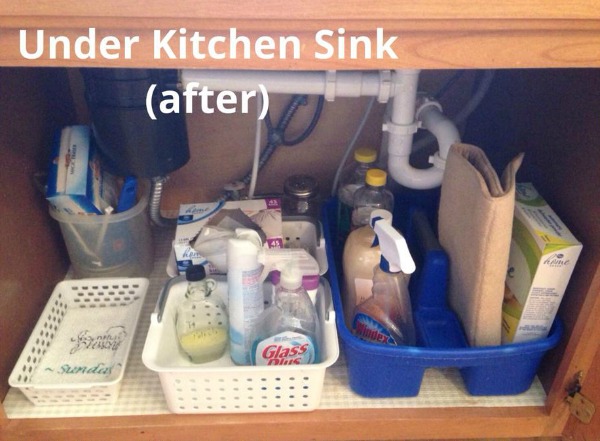
Identify the location of photo taken under a kitchen sink. (323, 147).